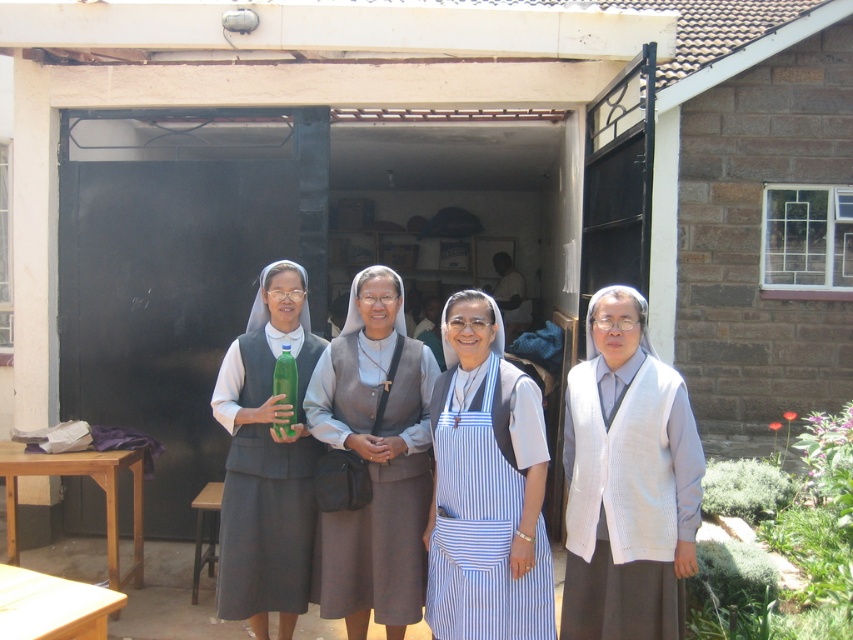
Is point (601, 557) positioned in front of point (352, 548)?

Yes, point (601, 557) is in front of point (352, 548).

Can you confirm if white knitted vest at center is wider than brown fabric dress at center?

No, white knitted vest at center is not wider than brown fabric dress at center.

Who is more forward, (601, 509) or (415, 387)?

Point (601, 509) is more forward.

Locate an element on the screen. The image size is (853, 640). white knitted vest at center is located at coordinates (627, 483).

Is point (509, 572) less distant than point (402, 372)?

Yes, point (509, 572) is closer to viewer.

Between point (496, 532) and point (323, 608), which one is positioned in front?

Point (496, 532)

Where is `blue striped apron at center`? The height and width of the screenshot is (640, 853). blue striped apron at center is located at coordinates (486, 488).

Locate an element on the screen. The height and width of the screenshot is (640, 853). brown fabric dress at center is located at coordinates (374, 460).

What do you see at coordinates (374, 460) in the screenshot?
I see `brown fabric dress at center` at bounding box center [374, 460].

Where is `brown fabric dress at center`? Image resolution: width=853 pixels, height=640 pixels. brown fabric dress at center is located at coordinates 374,460.